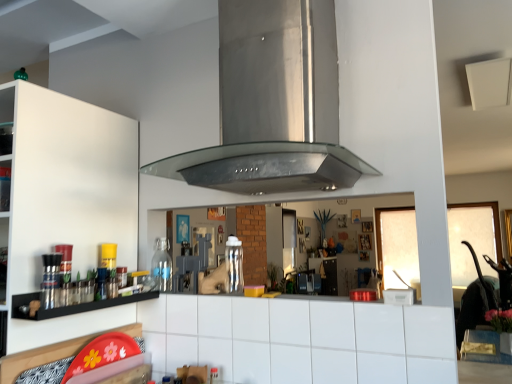
Question: From a real-world perspective, is transparent glass bottle at left, which is counted as the 2th bottle, starting from the right, physically located above or below stainless steel vent at center?

Choices:
 (A) below
 (B) above

Answer: (A)

Question: Is point (152, 258) closer or farther from the camera than point (260, 31)?

Choices:
 (A) closer
 (B) farther

Answer: (B)

Question: Which is nearer to the white matte cabinet at left?

Choices:
 (A) clear plastic bottle at center, marked as the 2th bottle in a back-to-front arrangement
 (B) transparent glass bottle at left, the 1th bottle from the left
 (C) black glass shelf at left
 (D) white tile counter at center
 (E) stainless steel vent at center

Answer: (C)

Question: Based on their relative distances, which object is farther from the clear plastic bottle at center, marked as the 2th bottle in a back-to-front arrangement?

Choices:
 (A) stainless steel vent at center
 (B) transparent glass bottle at left, the first bottle from the back
 (C) white matte cabinet at left
 (D) black glass shelf at left
 (E) white tile counter at center

Answer: (A)